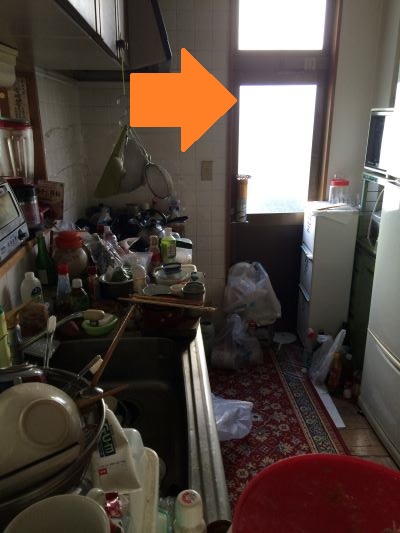
Where is `rug`? The width and height of the screenshot is (400, 533). rug is located at coordinates (282, 440).